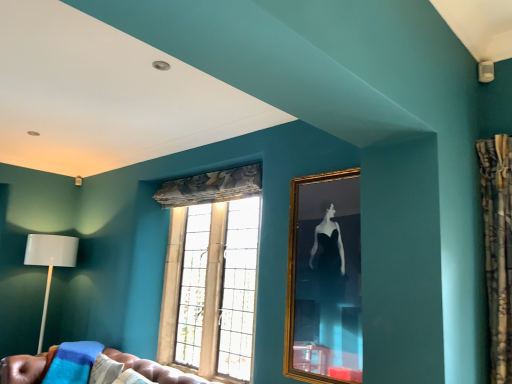
Question: From a real-world perspective, is white matte floor lamp at left under stained glass window at center?

Choices:
 (A) yes
 (B) no

Answer: (A)

Question: Is stained glass window at center surrounded by white matte floor lamp at left?

Choices:
 (A) yes
 (B) no

Answer: (B)

Question: Is white matte floor lamp at left behind stained glass window at center?

Choices:
 (A) no
 (B) yes

Answer: (B)

Question: Does white matte floor lamp at left have a larger size compared to stained glass window at center?

Choices:
 (A) yes
 (B) no

Answer: (A)

Question: Is white matte floor lamp at left completely or partially outside of stained glass window at center?

Choices:
 (A) no
 (B) yes

Answer: (B)

Question: Does white matte floor lamp at left lie in front of stained glass window at center?

Choices:
 (A) no
 (B) yes

Answer: (A)

Question: Is the surface of stained glass window at center in direct contact with gold-framed mirror at center-right?

Choices:
 (A) yes
 (B) no

Answer: (B)

Question: Does stained glass window at center have a lesser height compared to gold-framed mirror at center-right?

Choices:
 (A) yes
 (B) no

Answer: (B)

Question: Is stained glass window at center located outside gold-framed mirror at center-right?

Choices:
 (A) yes
 (B) no

Answer: (A)

Question: Is stained glass window at center facing towards gold-framed mirror at center-right?

Choices:
 (A) yes
 (B) no

Answer: (B)

Question: From a real-world perspective, is stained glass window at center below gold-framed mirror at center-right?

Choices:
 (A) yes
 (B) no

Answer: (A)

Question: Can you confirm if stained glass window at center is wider than gold-framed mirror at center-right?

Choices:
 (A) no
 (B) yes

Answer: (B)

Question: Is gold-framed mirror at center-right positioned with its back to white matte floor lamp at left?

Choices:
 (A) yes
 (B) no

Answer: (B)